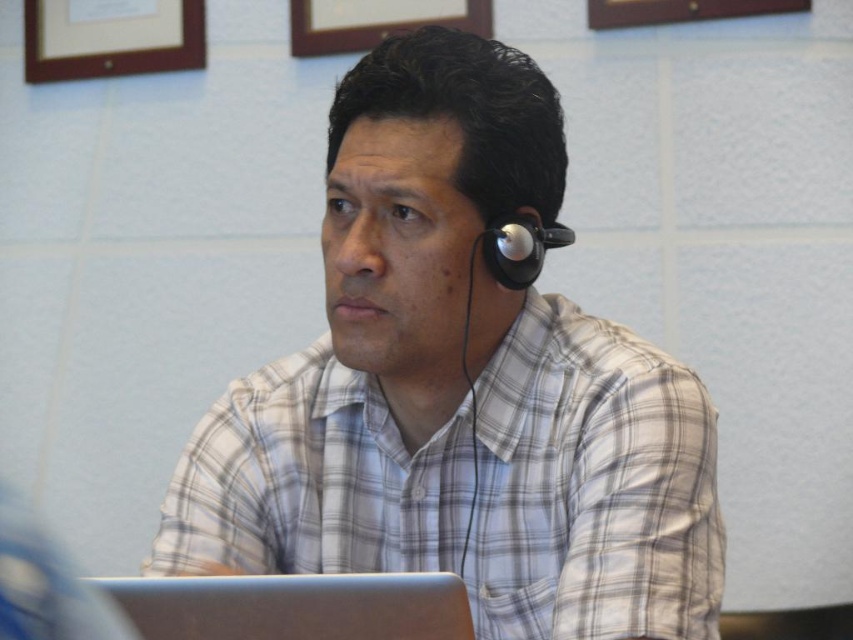
Can you confirm if white checkered shirt at center is positioned below silver metallic laptop at lower center?

Actually, white checkered shirt at center is above silver metallic laptop at lower center.

Is white checkered shirt at center above silver metallic laptop at lower center?

Indeed, white checkered shirt at center is positioned over silver metallic laptop at lower center.

Image resolution: width=853 pixels, height=640 pixels. In order to click on white checkered shirt at center in this screenshot , I will do `click(459, 387)`.

How much distance is there between white checkered shirt at center and wooden frame at upper left?

They are 4.89 feet apart.

Which is behind, point (437, 426) or point (102, 38)?

Positioned behind is point (102, 38).

Does point (412, 163) come closer to viewer compared to point (200, 10)?

Yes, it is.

Find the location of a particular element. white checkered shirt at center is located at coordinates (459, 387).

Is point (428, 611) more distant than point (74, 29)?

No, it is not.

From the picture: Can you confirm if silver metallic laptop at lower center is thinner than wooden frame at upper left?

Yes.

Identify the location of silver metallic laptop at lower center. (294, 605).